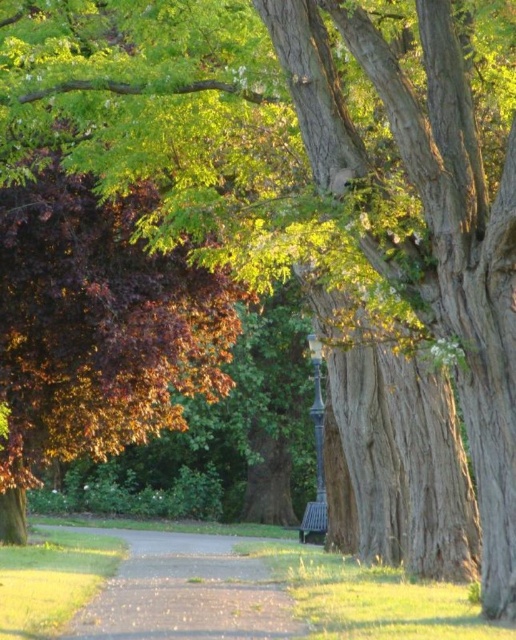
Between gravel path at center and wooden park bench at lower center, which one has less height?

wooden park bench at lower center

Can you confirm if gravel path at center is thinner than wooden park bench at lower center?

Incorrect, gravel path at center's width is not less than wooden park bench at lower center's.

Does point (191, 620) lie behind point (311, 508)?

No, (191, 620) is in front of (311, 508).

This screenshot has width=516, height=640. I want to click on gravel path at center, so click(x=185, y=592).